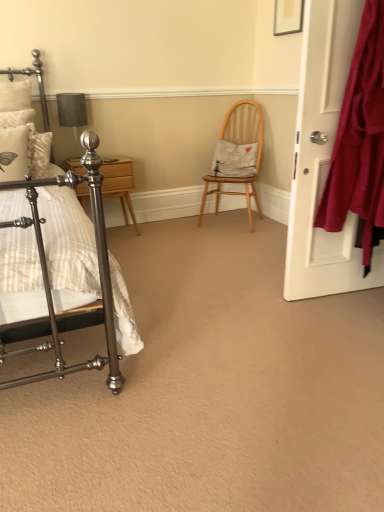
Question: Is white fabric pillow at center, which is the second pillow in left-to-right order, facing towards matte gray fabric at upper left?

Choices:
 (A) no
 (B) yes

Answer: (A)

Question: Is white fabric pillow at center, which is counted as the second pillow, starting from the front, turned away from matte gray fabric at upper left?

Choices:
 (A) yes
 (B) no

Answer: (B)

Question: From a real-world perspective, is white fabric pillow at center, arranged as the first pillow when viewed from the back, under matte gray fabric at upper left?

Choices:
 (A) no
 (B) yes

Answer: (B)

Question: Does white fabric pillow at center, which is counted as the second pillow, starting from the front, have a greater height compared to matte gray fabric at upper left?

Choices:
 (A) no
 (B) yes

Answer: (A)

Question: Can you confirm if white fabric pillow at center, arranged as the first pillow when viewed from the back, is smaller than matte gray fabric at upper left?

Choices:
 (A) no
 (B) yes

Answer: (A)

Question: From a real-world perspective, is white textured pillow at left, which appears as the 1th pillow when viewed from the front, positioned above or below white fabric pillow at center, which is counted as the second pillow, starting from the front?

Choices:
 (A) above
 (B) below

Answer: (A)

Question: Considering the positions of point (28, 115) and point (251, 162), is point (28, 115) closer or farther from the camera than point (251, 162)?

Choices:
 (A) closer
 (B) farther

Answer: (A)

Question: From their relative heights in the image, would you say white textured pillow at left, which appears as the 1th pillow when viewed from the front, is taller or shorter than white fabric pillow at center, arranged as the first pillow when viewed from the back?

Choices:
 (A) short
 (B) tall

Answer: (A)

Question: From the image's perspective, relative to white fabric pillow at center, marked as the first pillow in a right-to-left arrangement, is white textured pillow at left, which appears as the 1th pillow when viewed from the front, above or below?

Choices:
 (A) below
 (B) above

Answer: (B)

Question: Is matte white door at right to the left or to the right of polished metal bed at left in the image?

Choices:
 (A) left
 (B) right

Answer: (B)

Question: Considering the positions of point (360, 260) and point (43, 374), is point (360, 260) closer or farther from the camera than point (43, 374)?

Choices:
 (A) farther
 (B) closer

Answer: (A)

Question: Relative to polished metal bed at left, is matte white door at right in front or behind?

Choices:
 (A) behind
 (B) front

Answer: (A)

Question: Do you think matte white door at right is within polished metal bed at left, or outside of it?

Choices:
 (A) outside
 (B) inside

Answer: (A)

Question: In terms of height, does matte white door at right look taller or shorter compared to polished wood nightstand at left?

Choices:
 (A) tall
 (B) short

Answer: (A)

Question: In terms of size, does matte white door at right appear bigger or smaller than polished wood nightstand at left?

Choices:
 (A) small
 (B) big

Answer: (B)